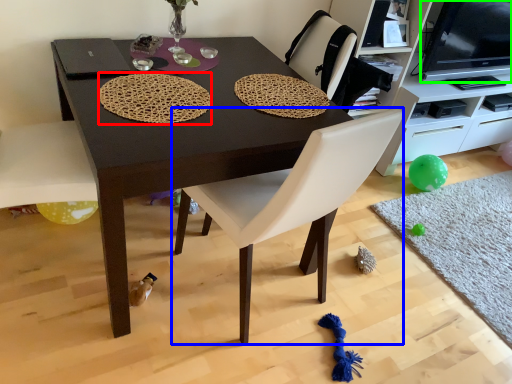
Question: Estimate the real-world distances between objects in this image. Which object is closer to mat (highlighted by a red box), chair (highlighted by a blue box) or television (highlighted by a green box)?

Choices:
 (A) chair
 (B) television

Answer: (A)